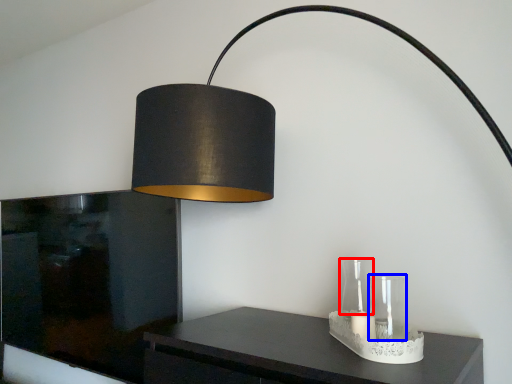
Question: Among these objects, which one is nearest to the camera, glass vase (highlighted by a red box) or glass vase (highlighted by a blue box)?

Choices:
 (A) glass vase
 (B) glass vase

Answer: (B)